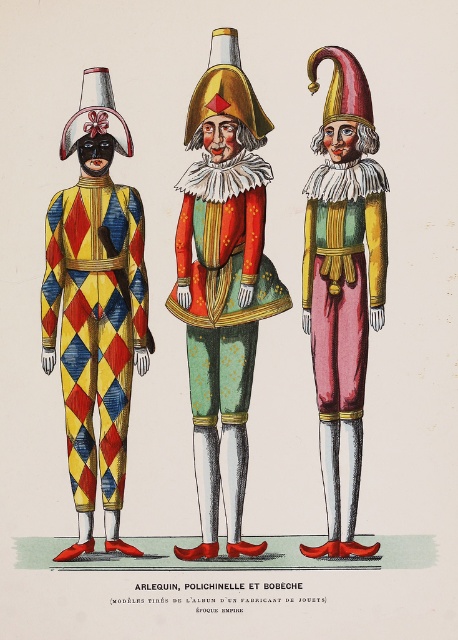
Question: Observing the image, what is the correct spatial positioning of harlequin costume at left in reference to matte yellow fabric pants at center?

Choices:
 (A) below
 (B) above

Answer: (A)

Question: Does matte gold and red costume at center come in front of harlequin costume at left?

Choices:
 (A) yes
 (B) no

Answer: (B)

Question: Is harlequin costume at center to the right of matte gold jester hat at center from the viewer's perspective?

Choices:
 (A) no
 (B) yes

Answer: (B)

Question: Based on their relative distances, which object is nearer to the matte gold jester hat at center?

Choices:
 (A) matte yellow fabric pants at center
 (B) harlequin costume at left
 (C) harlequin costume at center

Answer: (C)

Question: Which object is positioned farthest from the harlequin costume at center?

Choices:
 (A) matte yellow fabric pants at center
 (B) matte gold jester hat at center

Answer: (B)

Question: Which object is closer to the camera taking this photo?

Choices:
 (A) matte gold and red costume at center
 (B) matte gold jester hat at center
 (C) harlequin costume at center

Answer: (A)